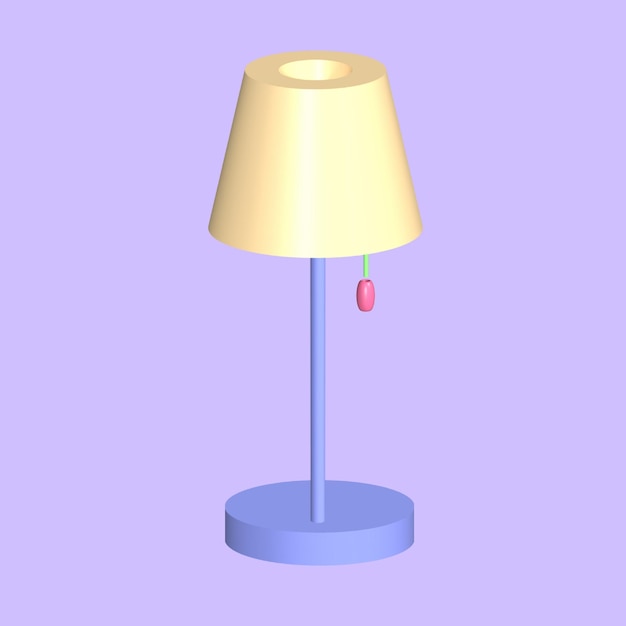
This screenshot has height=626, width=626. Find the location of `lamp shade`. lamp shade is located at coordinates (273, 213).